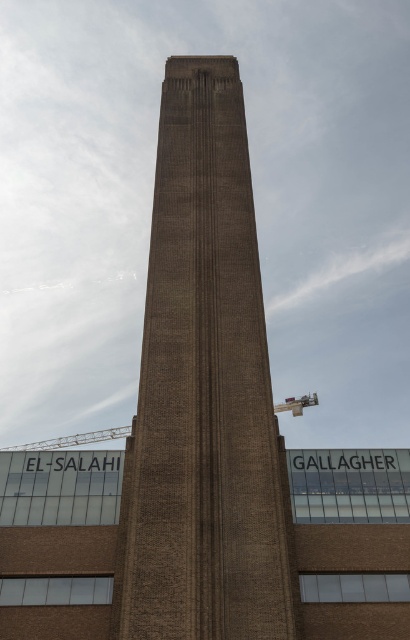
Does brown brick tower at center have a greater height compared to metallic construction crane at center?

In fact, brown brick tower at center may be shorter than metallic construction crane at center.

Is brown brick tower at center above metallic construction crane at center?

Indeed, brown brick tower at center is positioned over metallic construction crane at center.

The image size is (410, 640). What are the coordinates of `brown brick tower at center` in the screenshot? It's located at (204, 388).